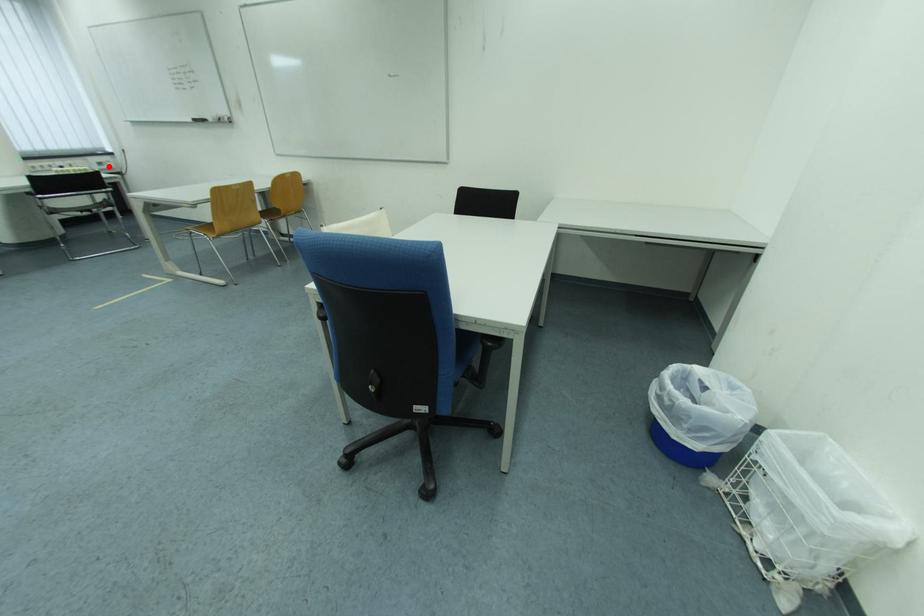
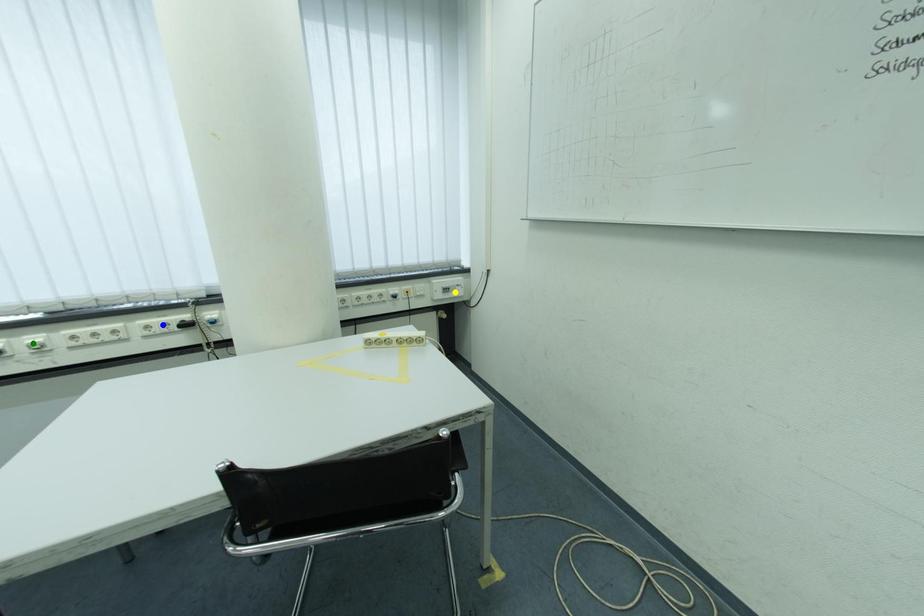
Question: I am providing you with two images of the same scene from different viewpoints. A red point is marked on the first image. You are given multiple points on the second image. Which mark in image 2 goes with the point in image 1?

Choices:
 (A) blue point
 (B) green point
 (C) yellow point

Answer: (C)